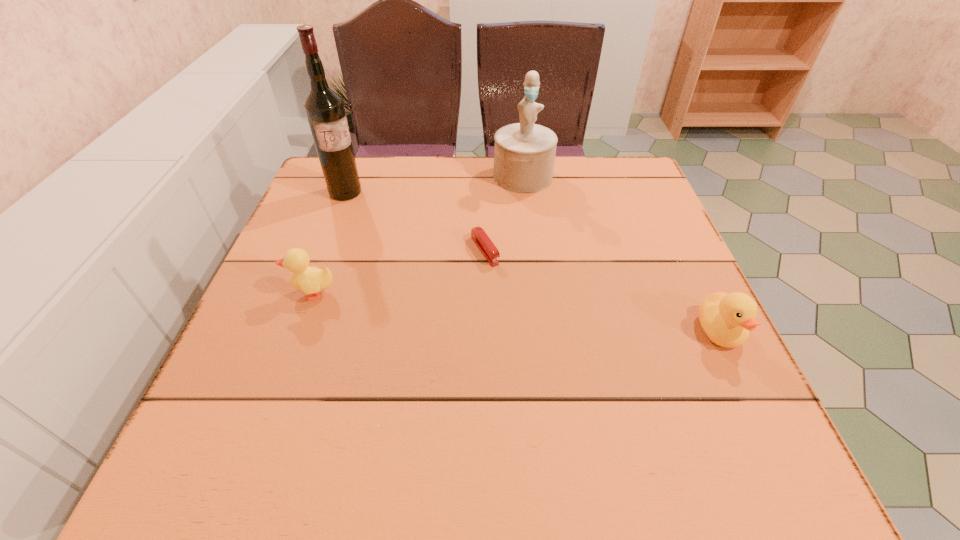
At what (x,y) coordinates should I click in order to perform the action: click on free space on the desktop that is between the farther duckling and the nearer duckling and is positioned on the front-facing side of the third farthest object. Please return your answer as a coordinate pair (x, y). The height and width of the screenshot is (540, 960). Looking at the image, I should click on (529, 313).

Locate an element on the screen. vacant spot on the desktop that is between the fourth farthest object and the nearest object and is positioned on the front and back of the wine bottle is located at coordinates (456, 306).

Identify the location of free space on the desktop that is between the left duckling and the nearest object and is positioned at the beak of the second tallest object. (525, 313).